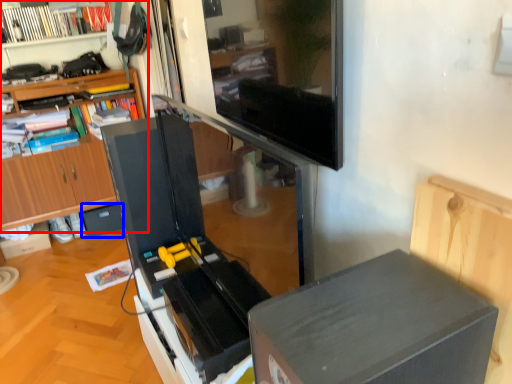
Question: Which object is closer to the camera taking this photo, bookcase (highlighted by a red box) or drawer (highlighted by a blue box)?

Choices:
 (A) bookcase
 (B) drawer

Answer: (A)